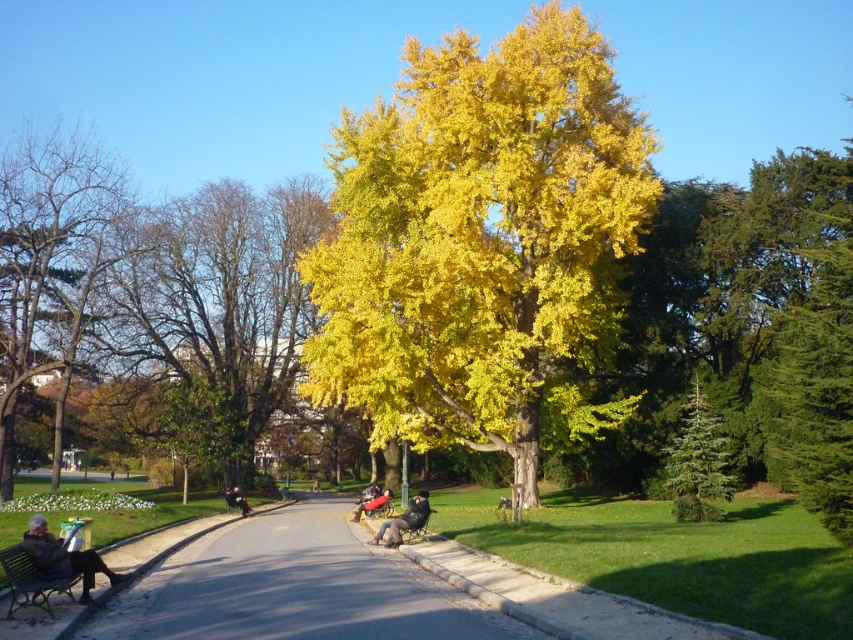
Which is in front, point (280, 360) or point (387, 529)?

Point (387, 529) is more forward.

Looking at this image, who is more distant from viewer, (308, 304) or (396, 529)?

Point (308, 304)

Find the location of a particular element. The image size is (853, 640). yellow/golden leaves at center is located at coordinates (219, 300).

Can you confirm if bare wood tree at left is positioned above matte black jacket at lower left?

Yes, bare wood tree at left is above matte black jacket at lower left.

Does bare wood tree at left have a smaller size compared to matte black jacket at lower left?

No, bare wood tree at left is not smaller than matte black jacket at lower left.

You are a GUI agent. You are given a task and a screenshot of the screen. Output one action in this format:
    pyautogui.click(x=<x>, y=<y>)
    Task: Click on the bare wood tree at left
    Image resolution: width=853 pixels, height=640 pixels.
    Given the screenshot: What is the action you would take?
    pyautogui.click(x=49, y=268)

This screenshot has height=640, width=853. I want to click on bare wood tree at left, so pos(49,268).

Is green painted wood bench at lower left closer to the viewer compared to dark brown leather jacket at center?

Yes, it is.

Is the position of green painted wood bench at lower left more distant than that of dark brown leather jacket at center?

No.

Is point (32, 596) farther from viewer compared to point (247, 513)?

No, (32, 596) is closer to viewer.

In order to click on green painted wood bench at lower left in this screenshot , I will do pos(32,580).